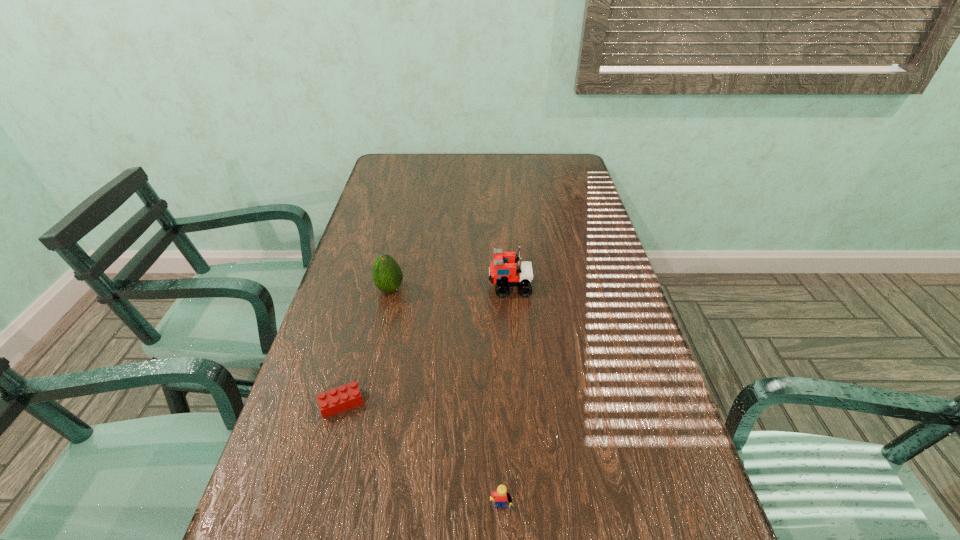
Identify which Lego is the second nearest to the farthest Lego. Please provide its 2D coordinates. Your answer should be formatted as a tuple, i.e. [(x, y)], where the tuple contains the x and y coordinates of a point satisfying the conditions above.

[(502, 497)]

Where is `the second closest Lego relative to the second nearest object`? The height and width of the screenshot is (540, 960). the second closest Lego relative to the second nearest object is located at coordinates (503, 271).

Image resolution: width=960 pixels, height=540 pixels. Identify the location of vacant space that satisfies the following two spatial constraints: 1. on the front-facing side of the tallest Lego; 2. on the front-facing side of the second shortest Lego. (527, 514).

Where is `free region that satisfies the following two spatial constraints: 1. on the front-facing side of the tallest Lego; 2. on the front-facing side of the nearest Lego`? The image size is (960, 540). free region that satisfies the following two spatial constraints: 1. on the front-facing side of the tallest Lego; 2. on the front-facing side of the nearest Lego is located at coordinates (527, 514).

Identify the location of free space that satisfies the following two spatial constraints: 1. on the front-facing side of the farthest Lego; 2. on the front side of the second nearest object. (518, 403).